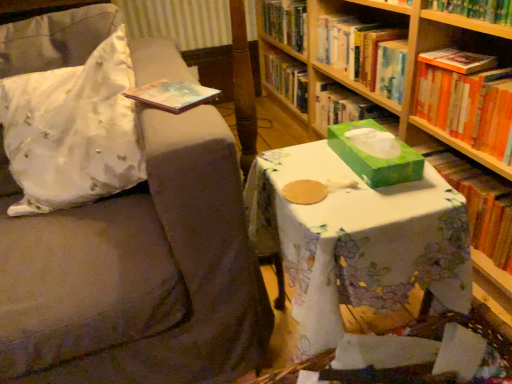
Locate an element on the screen. The height and width of the screenshot is (384, 512). blank space above orange hardcover book at right, the second book positioned from the bottom (from a real-world perspective) is located at coordinates (x=474, y=58).